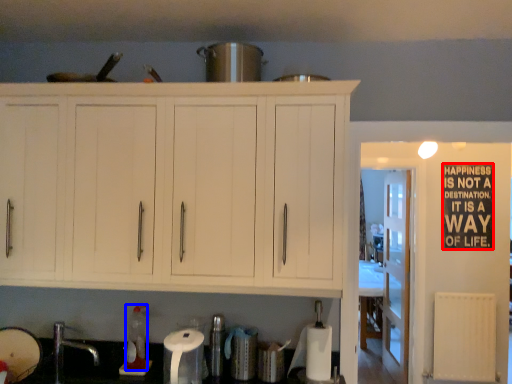
Question: Which point is closer to the camera, bulletin board (highlighted by a red box) or bottle (highlighted by a blue box)?

Choices:
 (A) bulletin board
 (B) bottle

Answer: (B)